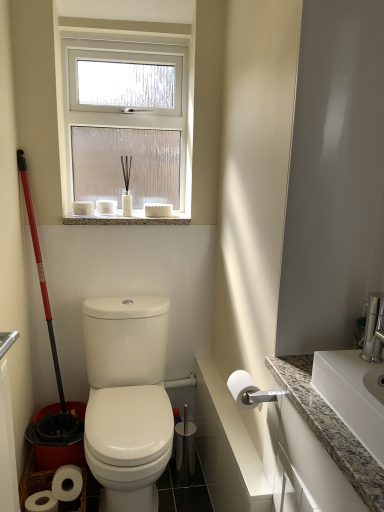
Question: Considering the relative sizes of white granite sink at right and white matte toilet paper at upper center, arranged as the 2th toilet paper when viewed from the back, in the image provided, is white granite sink at right wider than white matte toilet paper at upper center, arranged as the 2th toilet paper when viewed from the back,?

Choices:
 (A) no
 (B) yes

Answer: (B)

Question: Is white granite sink at right thinner than white matte toilet paper at upper center, the 1th toilet paper in the left-to-right sequence?

Choices:
 (A) yes
 (B) no

Answer: (B)

Question: From a real-world perspective, is white granite sink at right under white matte toilet paper at upper center, the 1th toilet paper in the left-to-right sequence?

Choices:
 (A) no
 (B) yes

Answer: (B)

Question: Is white granite sink at right looking in the opposite direction of white matte toilet paper at upper center, which appears as the third toilet paper when viewed from the right?

Choices:
 (A) yes
 (B) no

Answer: (B)

Question: Is white granite sink at right further to camera compared to white matte toilet paper at upper center, which appears as the third toilet paper when viewed from the right?

Choices:
 (A) yes
 (B) no

Answer: (B)

Question: Can you confirm if white granite sink at right is bigger than white matte toilet paper at upper center, marked as the 3th toilet paper in a bottom-to-top arrangement?

Choices:
 (A) yes
 (B) no

Answer: (A)

Question: Is white granite sink at right positioned far away from granite at upper center?

Choices:
 (A) no
 (B) yes

Answer: (B)

Question: Could you tell me if white granite sink at right is turned towards granite at upper center?

Choices:
 (A) yes
 (B) no

Answer: (B)

Question: Is white granite sink at right further to the viewer compared to granite at upper center?

Choices:
 (A) no
 (B) yes

Answer: (A)

Question: Is white granite sink at right bigger than granite at upper center?

Choices:
 (A) no
 (B) yes

Answer: (B)

Question: Is granite at upper center a part of white granite sink at right?

Choices:
 (A) no
 (B) yes

Answer: (A)

Question: From the image's perspective, is white granite sink at right beneath granite at upper center?

Choices:
 (A) no
 (B) yes

Answer: (B)

Question: Considering the relative sizes of white glossy toilet at center and clear glass window at upper center in the image provided, is white glossy toilet at center taller than clear glass window at upper center?

Choices:
 (A) yes
 (B) no

Answer: (B)